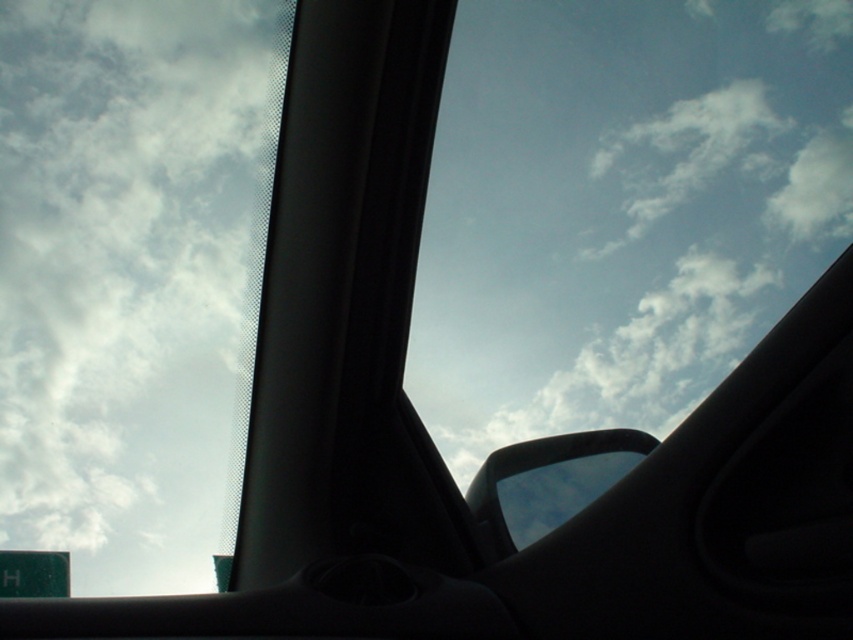
You are driving a car and looking through the windshield. You see a white fluffy cloud at upper left. Can you reach out your hand to touch it without leaving the car?

The white fluffy cloud at upper left is 6.32 feet away from the viewer, so you cannot reach it with your hand while staying inside the car.